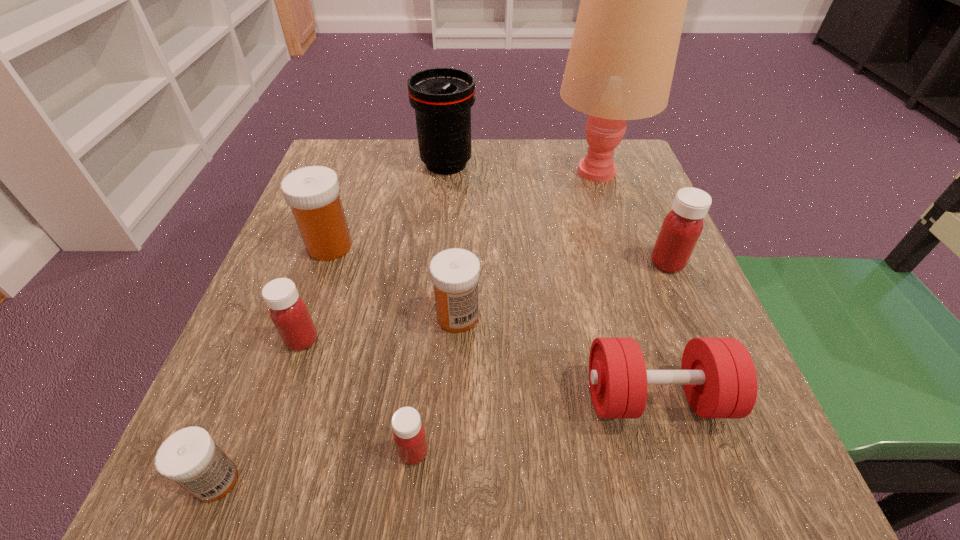
Choose which medicine is the fourth nearest neighbor to the rightmost white medicine. Please provide its 2D coordinates. Your answer should be formatted as a tuple, i.e. [(x, y)], where the tuple contains the x and y coordinates of a point satisfying the conditions above.

[(190, 457)]

Choose which white medicine is the second nearest neighbor to the lampshade. Please provide its 2D coordinates. Your answer should be formatted as a tuple, i.e. [(x, y)], where the tuple contains the x and y coordinates of a point satisfying the conditions above.

[(313, 192)]

Select which white medicine is the closest to the second biggest white medicine. Please provide its 2D coordinates. Your answer should be formatted as a tuple, i.e. [(x, y)], where the tuple contains the x and y coordinates of a point satisfying the conditions above.

[(313, 192)]

Identify which red medicine is the second nearest to the dumbbell. Please provide its 2D coordinates. Your answer should be formatted as a tuple, i.e. [(x, y)], where the tuple contains the x and y coordinates of a point satisfying the conditions above.

[(409, 435)]

Image resolution: width=960 pixels, height=540 pixels. I want to click on red medicine that is the closest one to the farthest red medicine, so click(x=409, y=435).

Where is `vacant region that satisfies the following two spatial constraints: 1. on the front side of the lampshade; 2. on the right side of the farthest red medicine`? The image size is (960, 540). vacant region that satisfies the following two spatial constraints: 1. on the front side of the lampshade; 2. on the right side of the farthest red medicine is located at coordinates coord(628,263).

The image size is (960, 540). What are the coordinates of `free region that satisfies the following two spatial constraints: 1. on the front side of the farthest white medicine; 2. on the left side of the second biggest white medicine` in the screenshot? It's located at [x=305, y=316].

You are a GUI agent. You are given a task and a screenshot of the screen. Output one action in this format:
    pyautogui.click(x=<x>, y=<y>)
    Task: Click on the vacant space that satisfies the following two spatial constraints: 1. on the front side of the farthest red medicine; 2. on the right side of the pink lampshade
    The width and height of the screenshot is (960, 540).
    Given the screenshot: What is the action you would take?
    pyautogui.click(x=628, y=263)